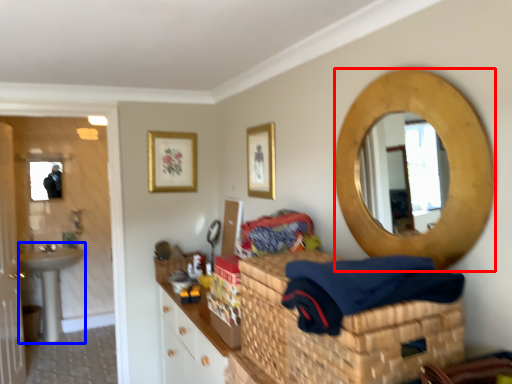
Question: Which object is closer to the camera taking this photo, oval (highlighted by a red box) or sink (highlighted by a blue box)?

Choices:
 (A) oval
 (B) sink

Answer: (A)